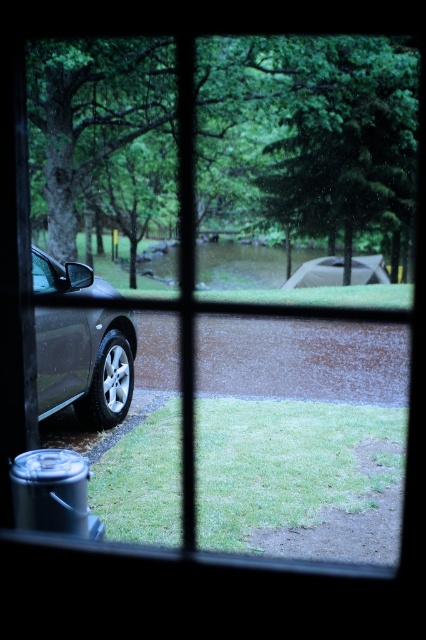
Question: Is green leafy tree at upper left thinner than green leafy tree at upper center?

Choices:
 (A) no
 (B) yes

Answer: (B)

Question: Among these objects, which one is farthest from the camera?

Choices:
 (A) green leafy tree at upper left
 (B) matte black car at left

Answer: (A)

Question: Is green leafy tree at upper left closer to camera compared to matte black car at left?

Choices:
 (A) yes
 (B) no

Answer: (B)

Question: Considering the real-world distances, which object is farthest from the green leafy tree at upper center?

Choices:
 (A) matte black car at left
 (B) green leafy tree at upper left

Answer: (A)

Question: Does green leafy tree at upper left have a larger size compared to green leafy tree at upper center?

Choices:
 (A) yes
 (B) no

Answer: (B)

Question: Which point appears closest to the camera in this image?

Choices:
 (A) (52, 396)
 (B) (336, 106)

Answer: (A)